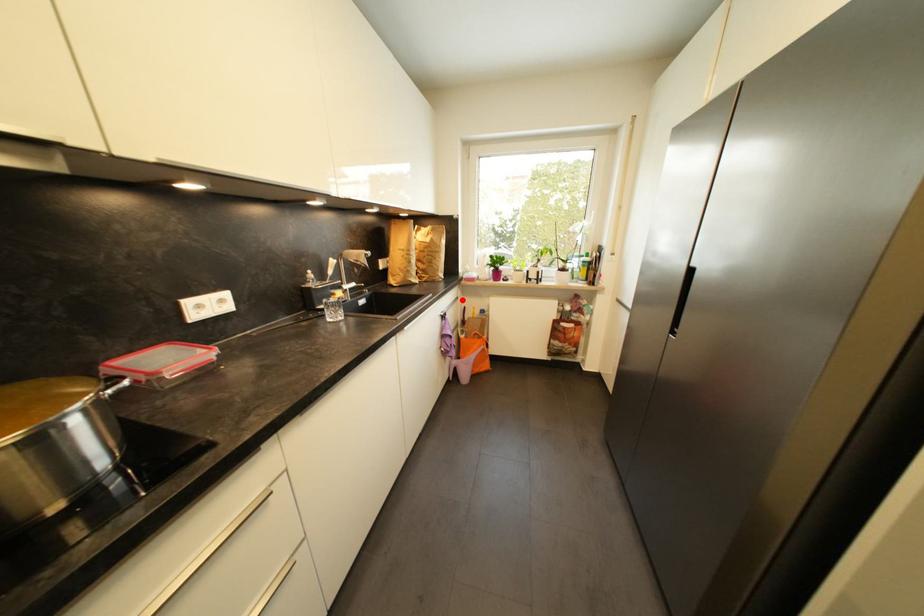
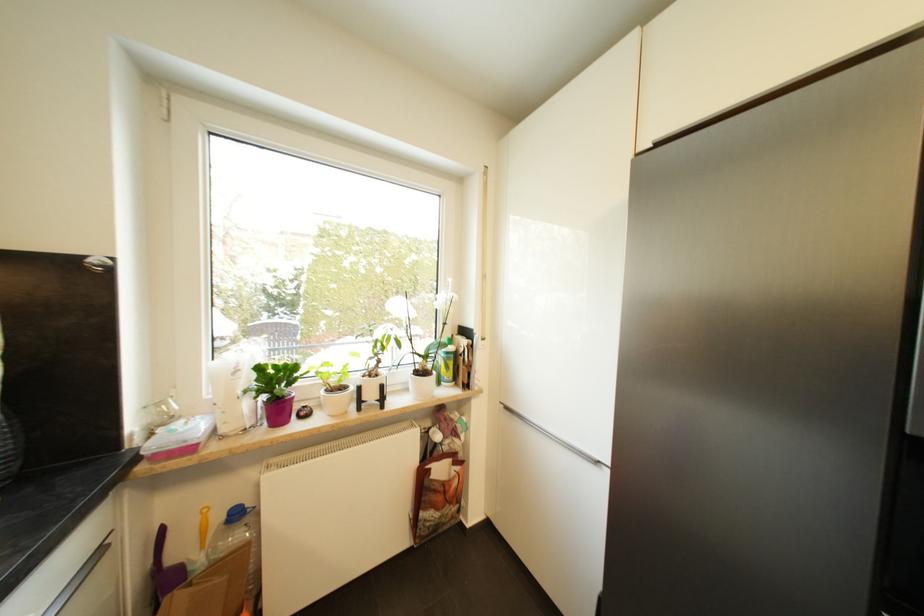
Locate, in the second image, the point that corresponds to the highlighted location in the first image.

(105, 553)